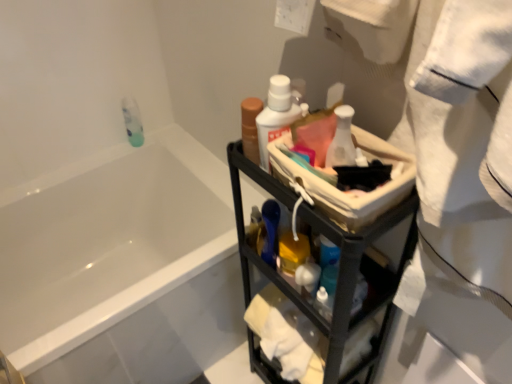
Question: From a real-world perspective, is white glossy bottle at center physically located above or below white cotton towel at right?

Choices:
 (A) above
 (B) below

Answer: (B)

Question: Is white glossy bottle at center to the left or to the right of white cotton towel at right in the image?

Choices:
 (A) right
 (B) left

Answer: (B)

Question: Based on their relative distances, which object is nearer to the white glossy bottle at center?

Choices:
 (A) white glossy bottle at upper center, which appears as the 3th mouthwash when viewed from the back
 (B) black metal cart at center
 (C) translucent plastic mouthwash at upper left, which appears as the third mouthwash when viewed from the front
 (D) white glossy bathtub at upper left
 (E) white cotton towel at right

Answer: (A)

Question: Which object is positioned farthest from the white glossy bathtub at upper left?

Choices:
 (A) black metal cart at center
 (B) white cotton towel at right
 (C) white glossy bottle at center
 (D) translucent plastic mouthwash at upper left, the 3th mouthwash from the right
 (E) white glossy bottle at upper center, which appears as the 3th mouthwash when viewed from the back

Answer: (C)